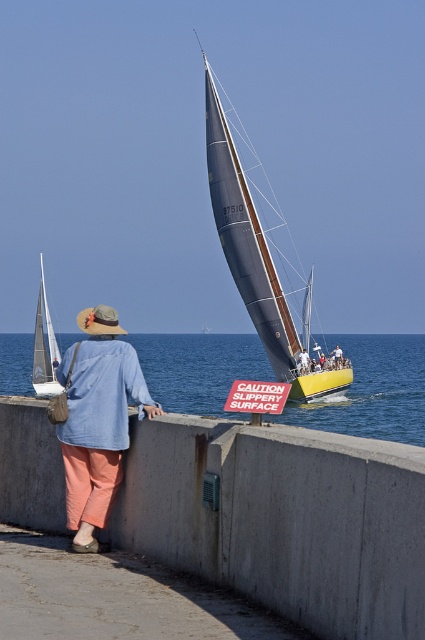
You are standing on the concrete at center and want to look at the shiny blue sailboat at center. Which direction should you look to see it?

The shiny blue sailboat at center is above the concrete at center, so you should look upward to see it.

You are standing at the edge of the walkway and want to reach the concrete at center. The maximum distance your wheelchair can travel is 6 meters. Can you safely reach it?

The distance between you and the concrete at center is 6.25 meters, which exceeds your wheelchair maximum distance of 6 meters. Therefore, you cannot safely reach it.